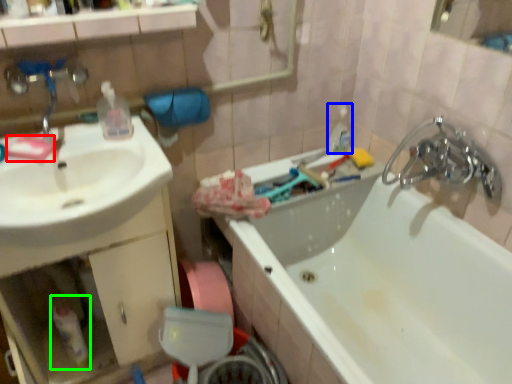
Question: Which object is positioned farthest from soap (highlighted by a red box)? Select from toiletry (highlighted by a blue box) and bottle (highlighted by a green box).

Choices:
 (A) toiletry
 (B) bottle

Answer: (A)